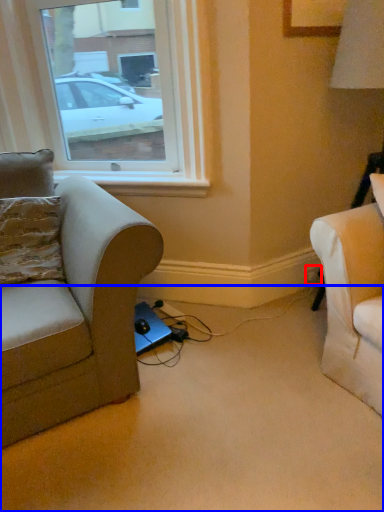
Question: Which object appears closest to the camera in this image, electric outlet (highlighted by a red box) or plain (highlighted by a blue box)?

Choices:
 (A) electric outlet
 (B) plain

Answer: (B)